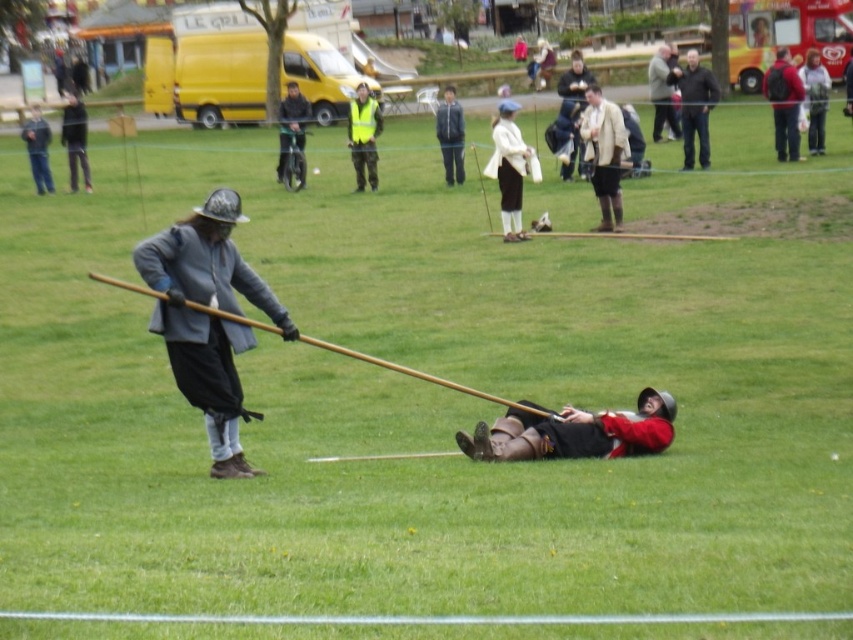
You are a photographer setting up for a historical reenactment. You need to position your camera so that both the green reflective vest at center and the matte black helmet at left are visible. Considering their heights, which object will appear smaller in your photo?

The green reflective vest at center appears smaller in the photo because it is not as tall as the matte black helmet at left.

You are a photographer trying to capture a clear shot of the dark brown leather jacket at upper center without the matte brown leather jacket at upper center blocking it. Is this possible given their positions?

The dark brown leather jacket at upper center is positioned under the matte brown leather jacket at upper center, so it is blocked and cannot be captured clearly without moving the matte brown leather jacket at upper center.

You are standing at the origin point in the park scene. Where is the matte beige coat at center located in terms of coordinates?

The matte beige coat at center is located at coordinates point [604,154].